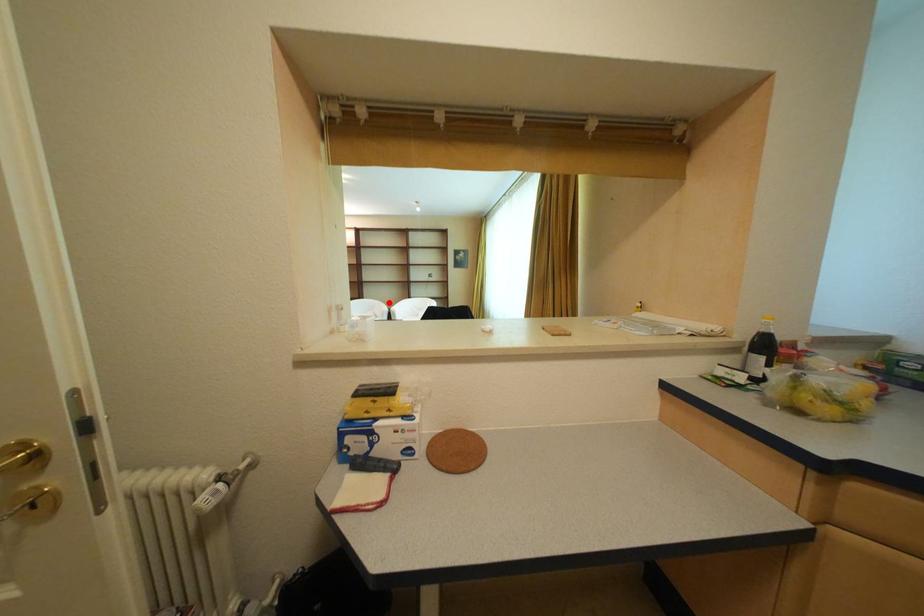
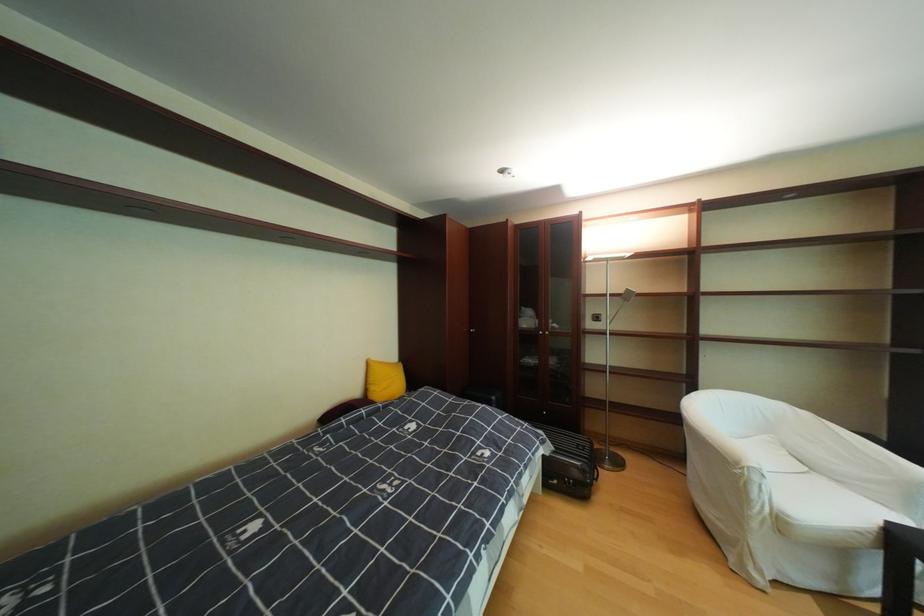
In the second image, find the point that corresponds to the highlighted location in the first image.

(793, 407)